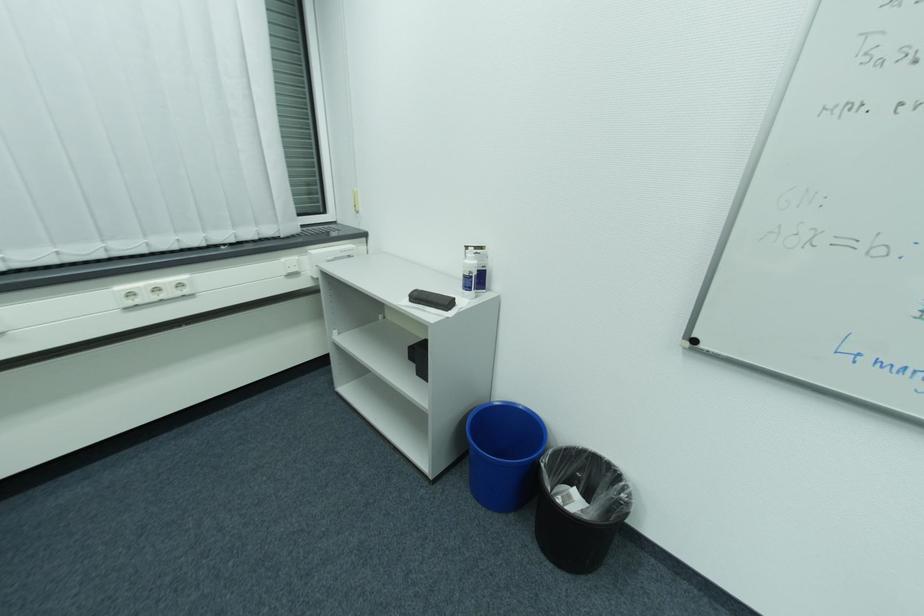
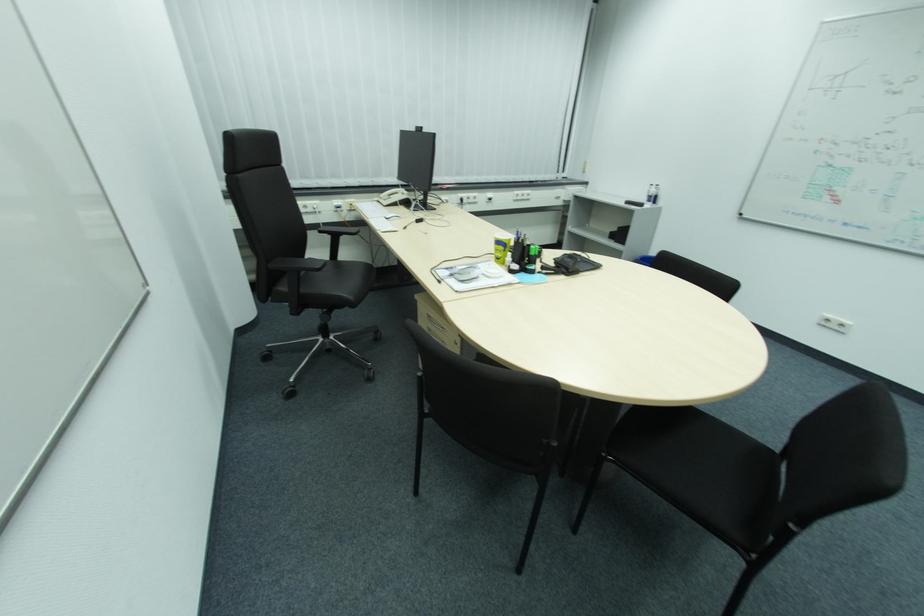
Locate, in the second image, the point that corresponds to pixel 478 264 in the first image.

(660, 191)